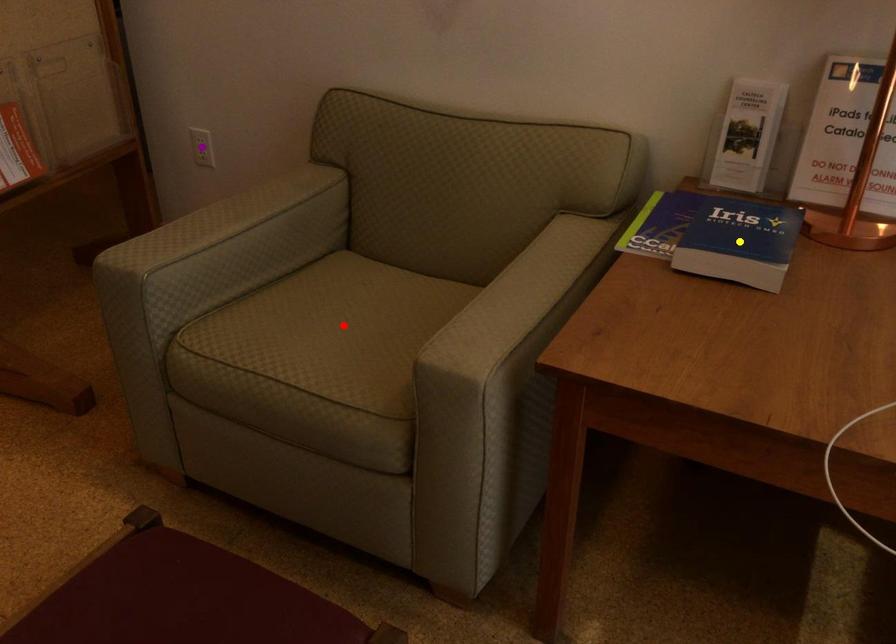
Order these from nearest to farthest:
yellow point, red point, purple point

yellow point → red point → purple point